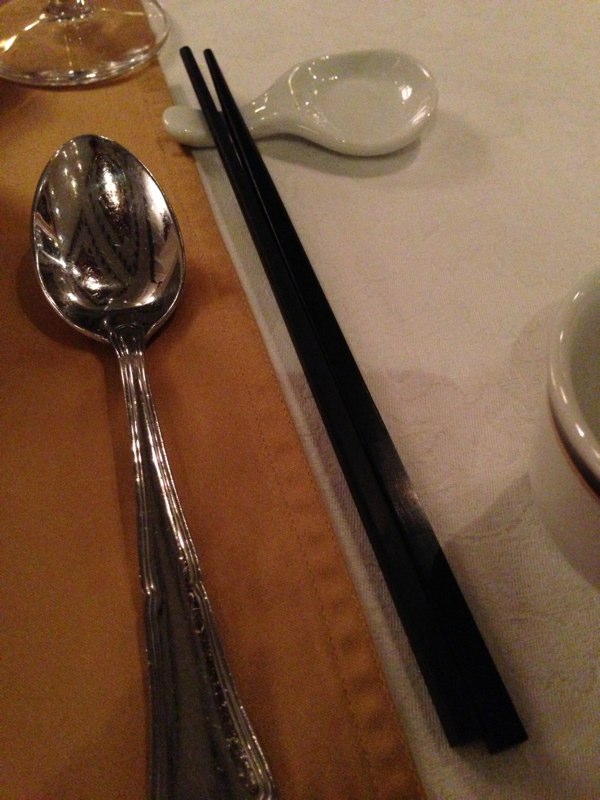
The height and width of the screenshot is (800, 600). In order to click on tablecloth in this screenshot , I will do `click(464, 421)`.